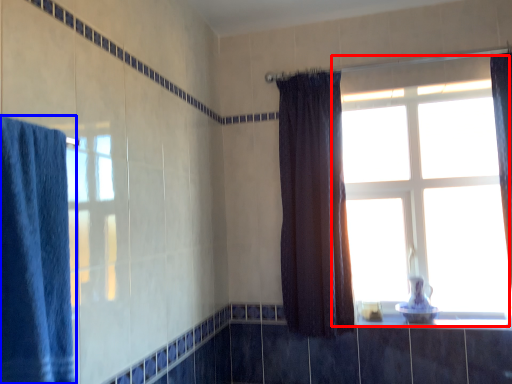
Question: Among these objects, which one is nearest to the camera, window (highlighted by a red box) or curtain (highlighted by a blue box)?

Choices:
 (A) window
 (B) curtain

Answer: (B)